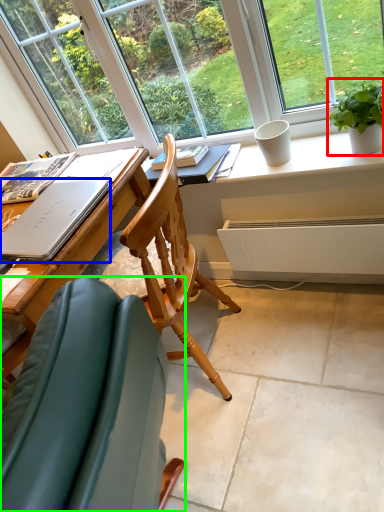
Question: Based on their relative distances, which object is nearer to houseplant (highlighted by a red box)? Choose from laptop (highlighted by a blue box) and chair (highlighted by a green box).

Choices:
 (A) laptop
 (B) chair

Answer: (A)